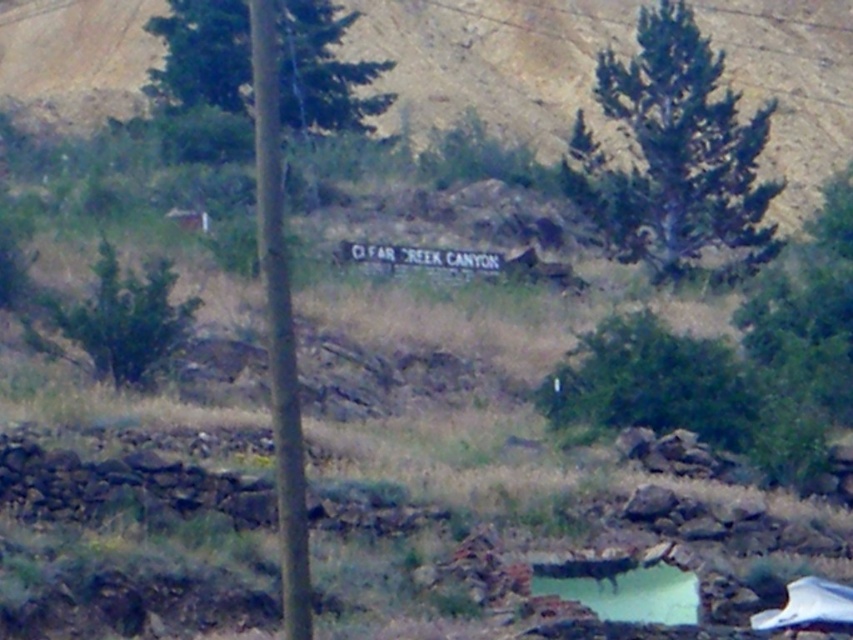
You are standing at the center of the scene and want to take a photo of the green textured tree at upper right. Based on its coordinates, in which direction should you point your camera to capture it?

The green textured tree at upper right is located at coordinates point (676, 156), so you should point your camera to the upper right direction to capture it.

You are a hiker trying to locate the sign for Clear Creek Canyon. You see the green grassy hillside at center and the green textured tree at upper right. Which direction should you look to find the sign?

The green grassy hillside at center is to the left of the green textured tree at upper right, so the sign is likely located to the left of the green textured tree at upper right.

You are standing at the base of the green grassy hillside at center and want to reach the sign in the midground. Which direction should you move to get closer to the sign?

Since the green grassy hillside at center is located at point (494, 64), you should move towards the sign in the midground by going forward or backward depending on your current position relative to the coordinates provided.